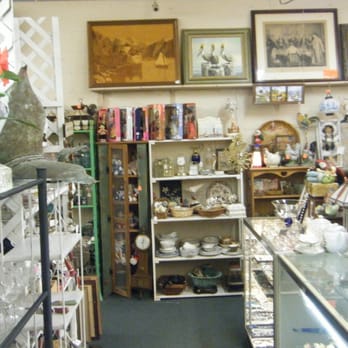
The image size is (348, 348). In order to click on blue flooring in this screenshot , I will do [x=138, y=332].